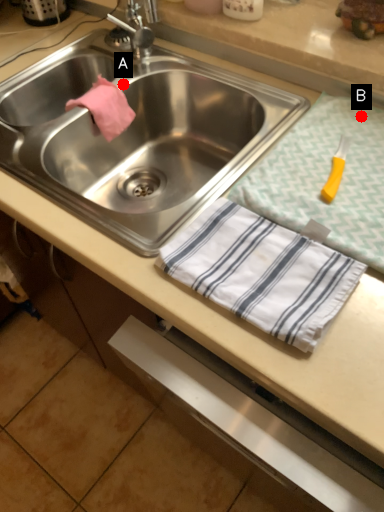
Question: Two points are circled on the image, labeled by A and B beside each circle. Which point is farther from the camera taking this photo?

Choices:
 (A) A is further
 (B) B is further

Answer: (A)